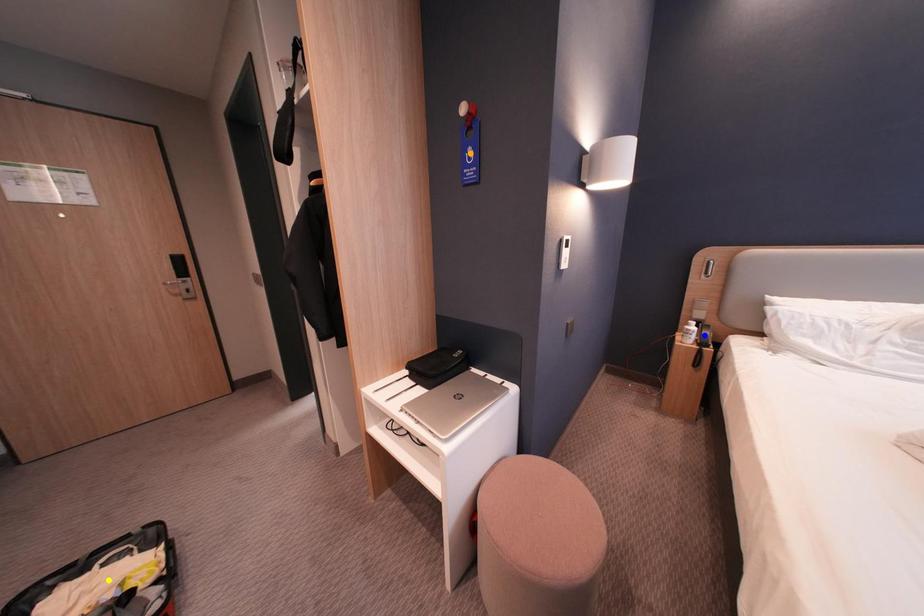
Order these from nearest to farthest:
- yellow point
- orange point
- blue point

1. yellow point
2. orange point
3. blue point